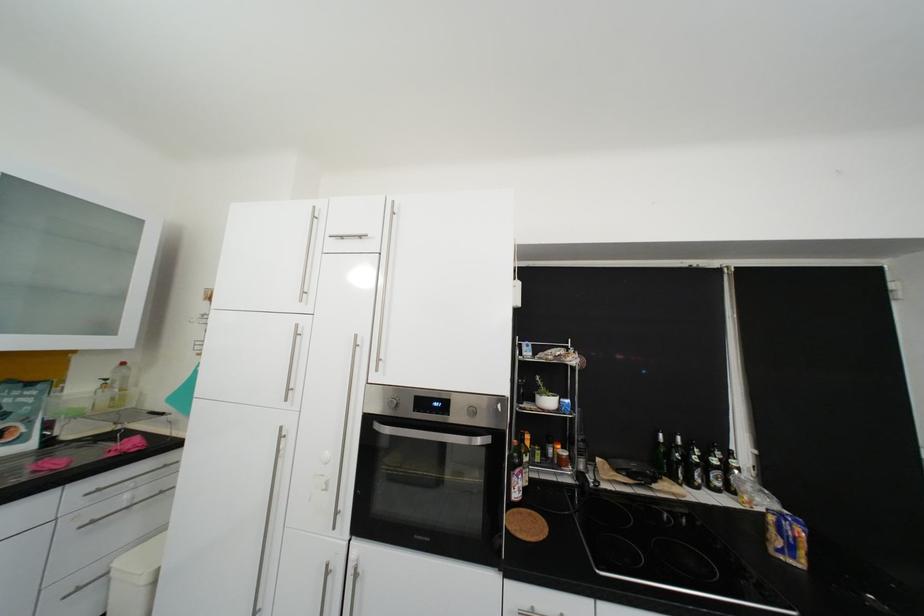
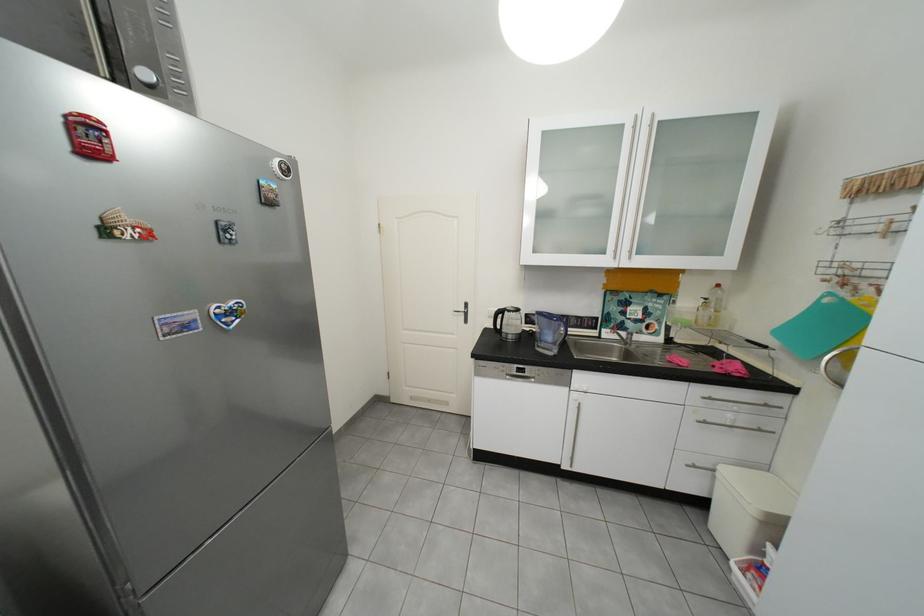
The point at [125,573] is marked in the first image. Where is the corresponding point in the second image?

(730, 476)